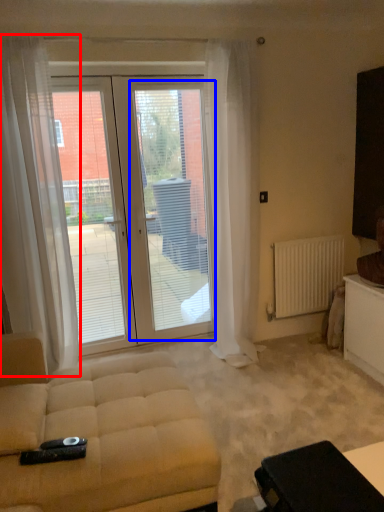
Question: Which point is closer to the camera, curtain (highlighted by a red box) or screen door (highlighted by a blue box)?

Choices:
 (A) curtain
 (B) screen door

Answer: (A)